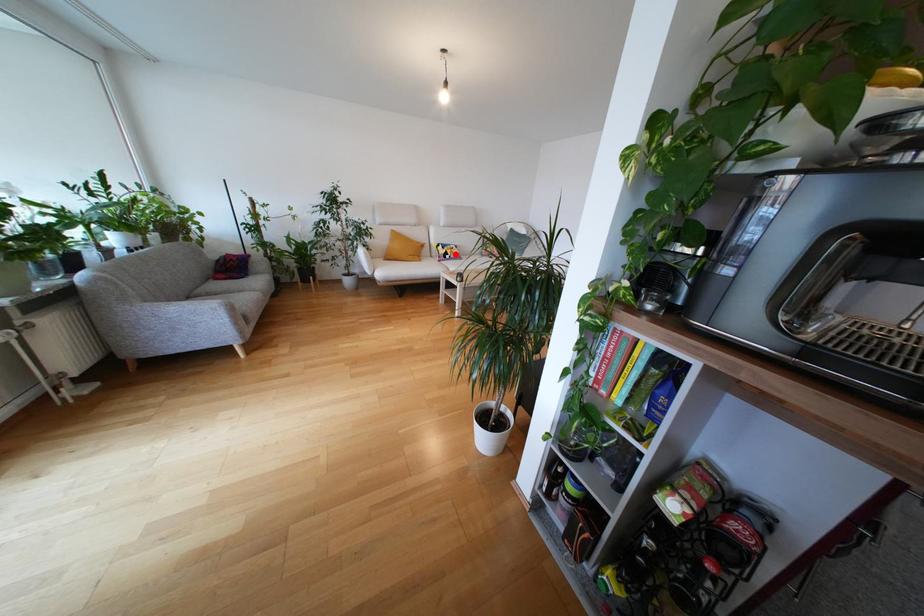
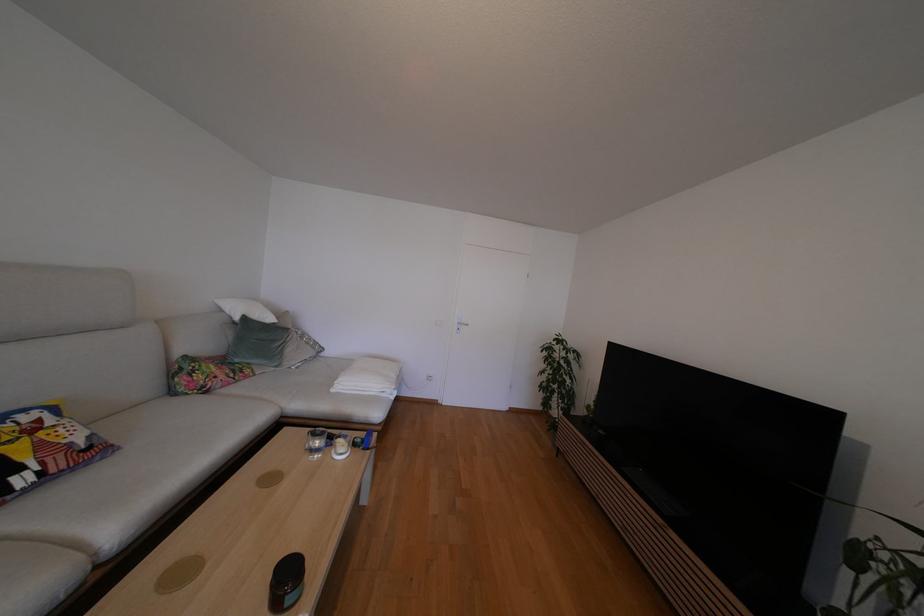
Where in the second image is the point corresponding to the highlighted location from the first image?

(44, 448)